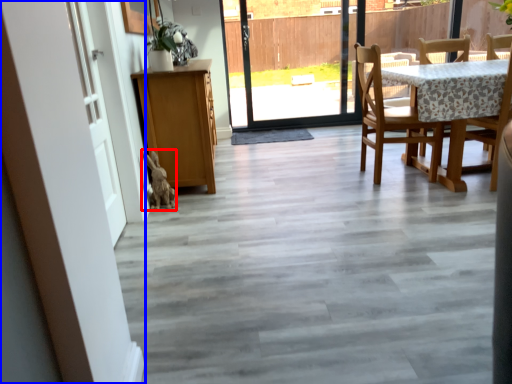
Question: Which object is further to the camera taking this photo, animal (highlighted by a red box) or barn door (highlighted by a blue box)?

Choices:
 (A) animal
 (B) barn door

Answer: (A)